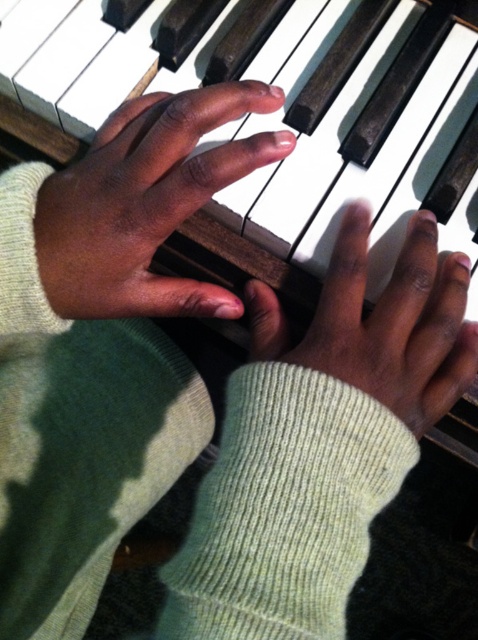
You are a photographer trying to capture the hands playing the piano. Which hand, the dark skin hand at upper center or the smooth skin hand at center, is closer to the camera lens?

The dark skin hand at upper center is closer to the camera lens because the smooth skin hand at center is behind it.

You are a photographer setting up a close shot of two hands on a piano. The scene requires that the wider hand must be placed on the left side of the narrower one to frame the composition properly. Given the dark skin hand at upper center and the smooth skin hand at center, which hand should be positioned on the left to meet this requirement?

The dark skin hand at upper center is wider than the smooth skin hand at center, so it should be placed on the left side to meet the composition requirement.